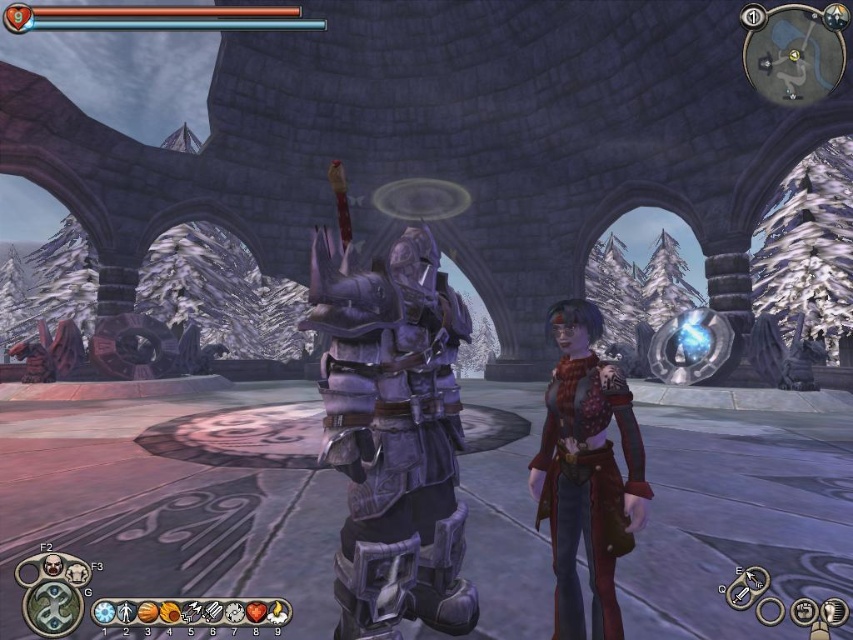
You are a game developer checking the character positioning in a fantasy scene. You need to ensure that both characters are visible to players. Since both the polished purple armor at center and the red leather jacket at center are at the center, which one might be more visible to players?

The polished purple armor at center is positioned over red leather jacket at center, so the polished purple armor at center is more visible because it is in front.

You are a game developer designing a new level where both the polished purple armor at center and the red leather jacket at center must fit through a narrow doorway. Based on their sizes, which character might have difficulty passing through if the doorway is only wide enough for one?

The polished purple armor at center might have difficulty passing through the doorway since it might be wider than the red leather jacket at center.